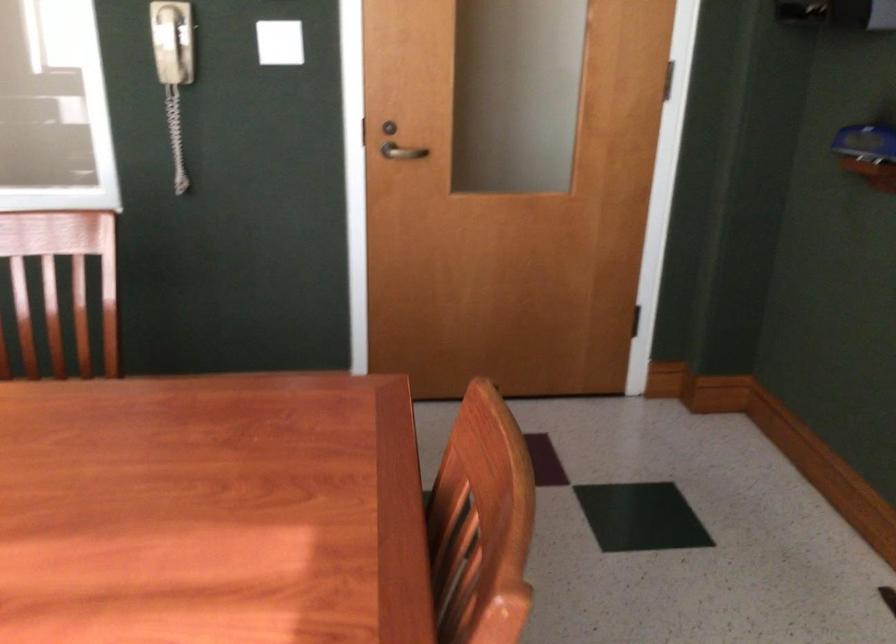
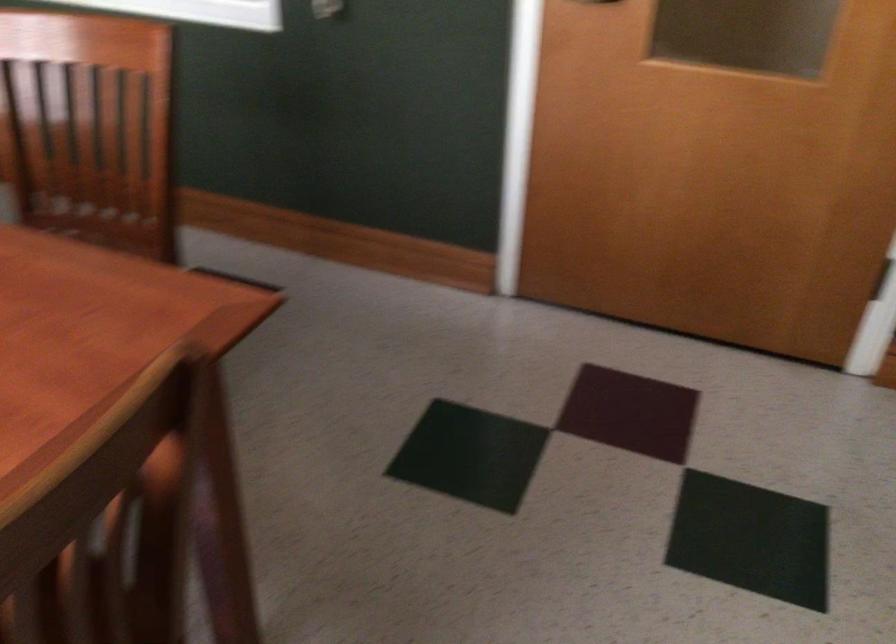
Which direction would the cameraman need to move to produce the second image?

The cameraman moved toward right, forward.